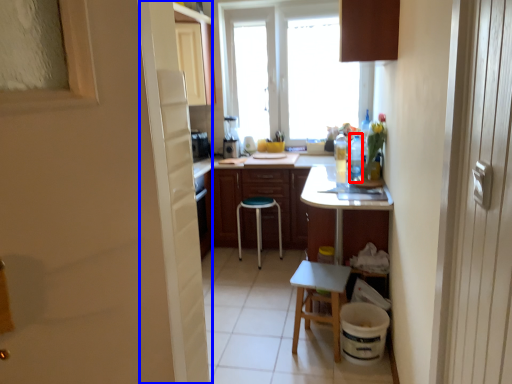
Question: Which object appears farthest to the camera in this image, bottle (highlighted by a red box) or screen door (highlighted by a blue box)?

Choices:
 (A) bottle
 (B) screen door

Answer: (A)